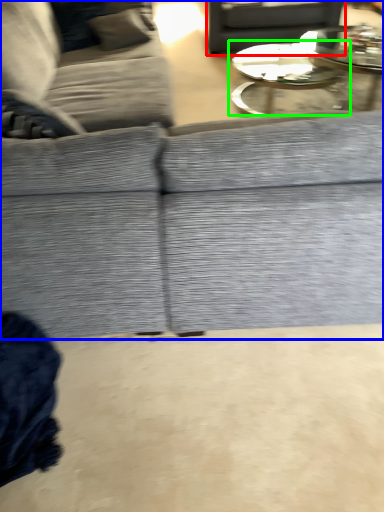
Question: Based on their relative distances, which object is farther from gray (highlighted by a red box)? Choose from studio couch (highlighted by a blue box) and coffee table (highlighted by a green box).

Choices:
 (A) studio couch
 (B) coffee table

Answer: (A)